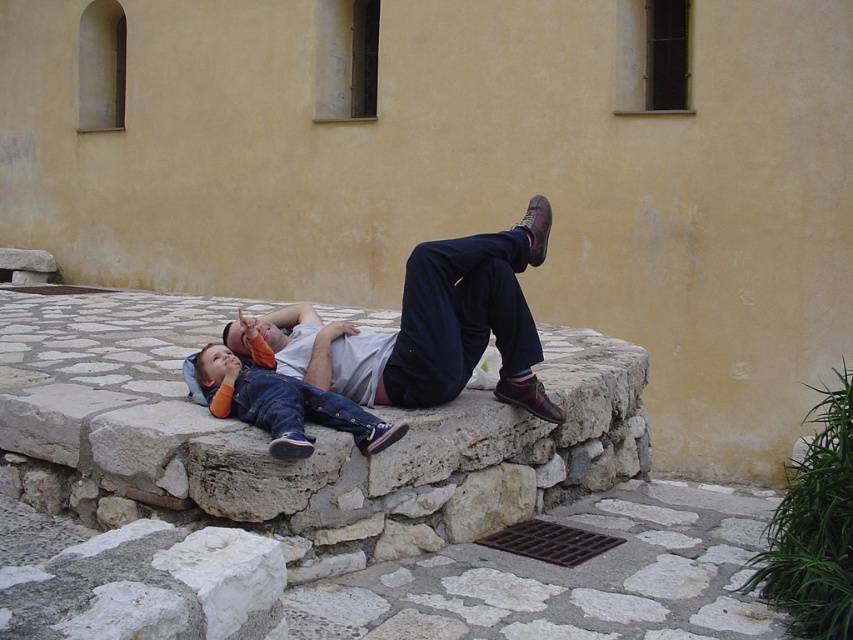
Question: Observing the image, what is the correct spatial positioning of matte white shirt at center in reference to denim pants at center?

Choices:
 (A) left
 (B) right

Answer: (B)

Question: Observing the image, what is the correct spatial positioning of matte white shirt at center in reference to denim pants at center?

Choices:
 (A) left
 (B) right

Answer: (B)

Question: Which point is farther to the camera?

Choices:
 (A) (451, 253)
 (B) (218, 352)

Answer: (B)

Question: Which point is farther to the camera?

Choices:
 (A) (289, 416)
 (B) (451, 260)

Answer: (B)

Question: Is the position of matte white shirt at center less distant than that of denim pants at center?

Choices:
 (A) no
 (B) yes

Answer: (A)